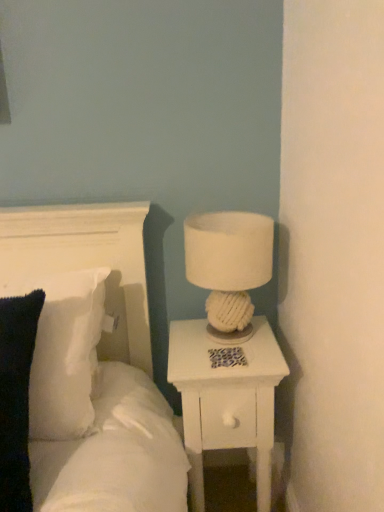
Find the location of `vacant space underneath white fabric lampshade at upper right (from a real-world perspective)`. vacant space underneath white fabric lampshade at upper right (from a real-world perspective) is located at coordinates (224, 339).